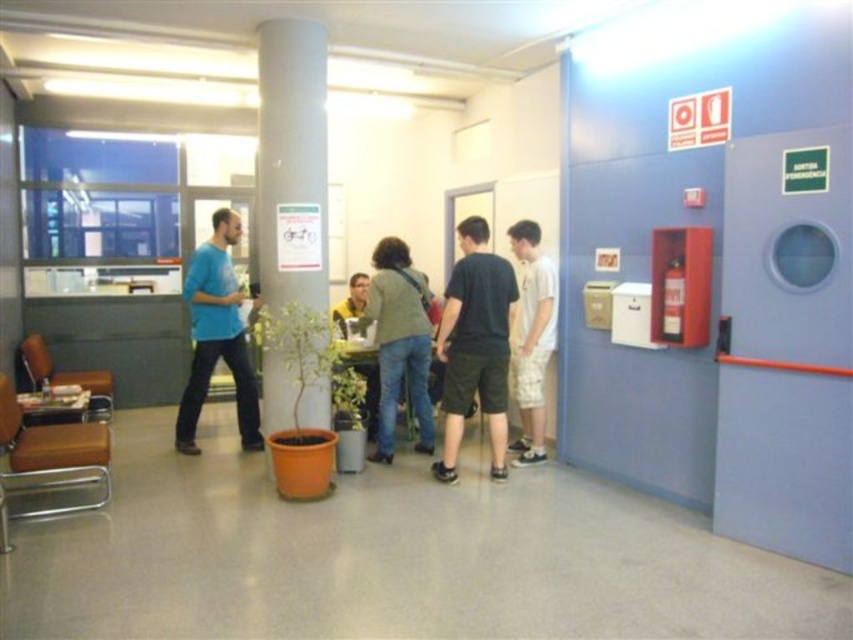
You are a customer entering the reception area and see the dark green shorts at center and the white cotton shirt at right. Which item is taller?

The dark green shorts at center is taller than the white cotton shirt at right.

You are standing in the waiting area and need to reach the exit, which is located behind the gray matte pillar at center. The pillar is 14.27 feet away from you. If your walking speed is 3 feet per second, how many seconds will it take you to reach the exit?

To reach the exit behind the gray matte pillar at center, which is 14.27 feet away, at a speed of 3 feet per second, you would divide the distance by the speed. 14.27 divided by 3 equals approximately 4.76 seconds. Therefore, it will take roughly 4.8 seconds to reach the exit.